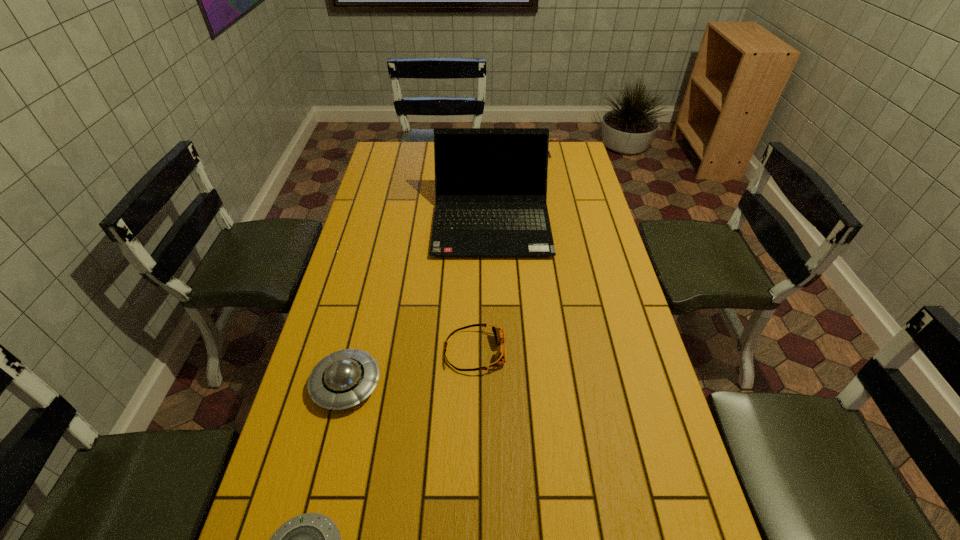
You are a GUI agent. You are given a task and a screenshot of the screen. Output one action in this format:
    pyautogui.click(x=<x>, y=<y>)
    Task: Click on the laptop computer
    This screenshot has height=540, width=960.
    Given the screenshot: What is the action you would take?
    pyautogui.click(x=490, y=183)

Locate an element on the screen. the tallest object is located at coordinates (490, 183).

Image resolution: width=960 pixels, height=540 pixels. Find the location of `the farthest object`. the farthest object is located at coordinates (550, 139).

The image size is (960, 540). What are the coordinates of `the fourth shortest object` in the screenshot? It's located at (550, 139).

Locate an element on the screen. This screenshot has width=960, height=540. the taller saucer is located at coordinates (342, 379).

Where is `the third shortest object`? the third shortest object is located at coordinates (342, 379).

Find the location of a particular element. goggles is located at coordinates (499, 333).

The image size is (960, 540). Find the location of `free space located on the screen of the tallest object`. free space located on the screen of the tallest object is located at coordinates (493, 288).

Where is `free space located on the front-facing side of the fourth shortest object`? free space located on the front-facing side of the fourth shortest object is located at coordinates (547, 195).

The width and height of the screenshot is (960, 540). What are the coordinates of `vacant space located on the right of the farther saucer` in the screenshot? It's located at (416, 384).